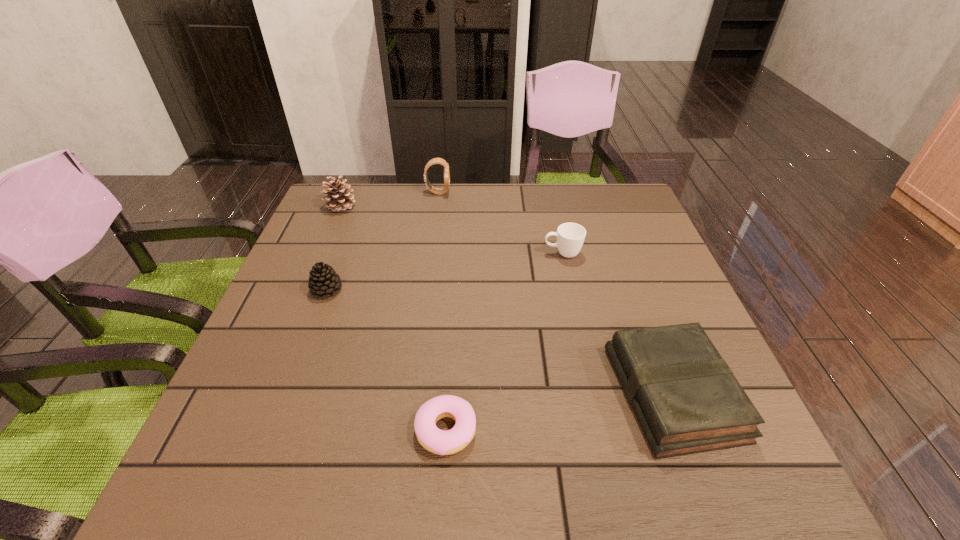
Locate an element on the screen. object that is positioned at the right edge is located at coordinates (686, 399).

The width and height of the screenshot is (960, 540). In order to click on object that is at the far left corner in this screenshot , I will do `click(338, 192)`.

The height and width of the screenshot is (540, 960). What are the coordinates of `object that is at the near right corner` in the screenshot? It's located at (686, 399).

At what (x,y) coordinates should I click in order to perform the action: click on vacant space at the far edge. Please return your answer as a coordinate pair (x, y). The width and height of the screenshot is (960, 540). Looking at the image, I should click on (460, 217).

Locate an element on the screen. vacant space at the left edge is located at coordinates (265, 349).

Find the location of a particular element. The image size is (960, 540). free space at the right edge of the desktop is located at coordinates (636, 306).

You are a GUI agent. You are given a task and a screenshot of the screen. Output one action in this format:
    pyautogui.click(x=<x>, y=<y>)
    Task: Click on the free space at the far left corner
    The height and width of the screenshot is (540, 960).
    Given the screenshot: What is the action you would take?
    pyautogui.click(x=333, y=222)

At what (x,y) coordinates should I click in order to perform the action: click on vacant space at the near left corner of the desktop. Please return your answer as a coordinate pair (x, y). This screenshot has height=540, width=960. Looking at the image, I should click on (220, 466).

Image resolution: width=960 pixels, height=540 pixels. Identify the location of vacant area at the far right corner of the desktop. (623, 220).

The height and width of the screenshot is (540, 960). Find the location of `free space between the cup and the watch`. free space between the cup and the watch is located at coordinates (500, 222).